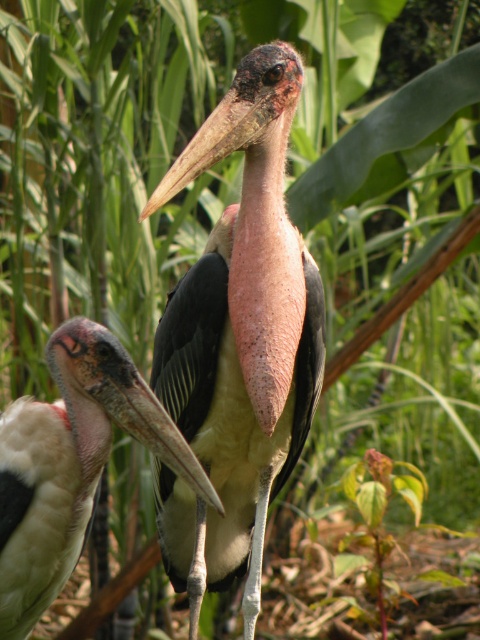
Who is shorter, speckled pinkish-brown marabou stork at center or light brown feathered bird at center?

Standing shorter between the two is light brown feathered bird at center.

Is speckled pinkish-brown marabou stork at center wider than light brown feathered bird at center?

Indeed, speckled pinkish-brown marabou stork at center has a greater width compared to light brown feathered bird at center.

Image resolution: width=480 pixels, height=640 pixels. What do you see at coordinates (239, 340) in the screenshot?
I see `speckled pinkish-brown marabou stork at center` at bounding box center [239, 340].

Find the location of a particular element. speckled pinkish-brown marabou stork at center is located at coordinates (239, 340).